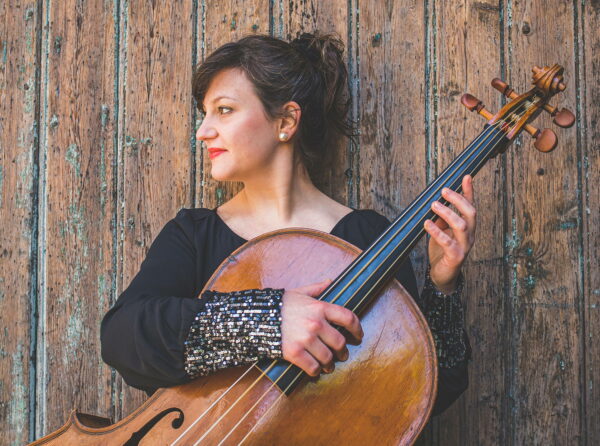
At what (x,y) coordinates should I click in order to perform the action: click on wooden wall. Please return your answer as a coordinate pair (x, y). Image resolution: width=600 pixels, height=446 pixels. Looking at the image, I should click on (114, 90).